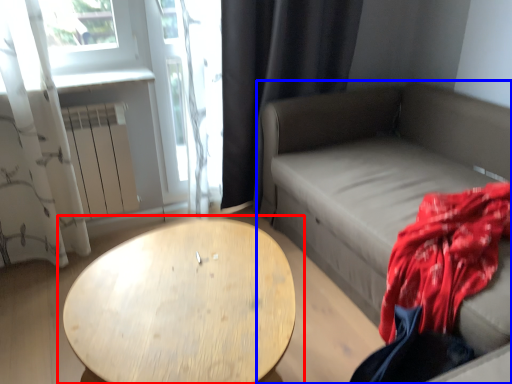
Question: Which point is closer to the camera, table (highlighted by a red box) or studio couch (highlighted by a blue box)?

Choices:
 (A) table
 (B) studio couch

Answer: (A)